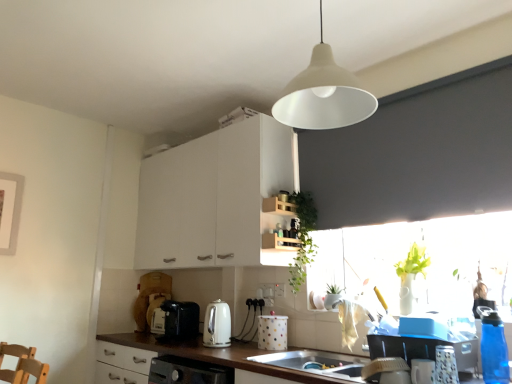
Question: Is there a large distance between black plastic toaster at lower center, the 7th appliance viewed from the front, and transparent glass window at right?

Choices:
 (A) no
 (B) yes

Answer: (B)

Question: Can you confirm if black plastic toaster at lower center, arranged as the first appliance when viewed from the back, is positioned to the right of transparent glass window at right?

Choices:
 (A) no
 (B) yes

Answer: (A)

Question: Does black plastic toaster at lower center, the seventh appliance positioned from the right, have a greater width compared to transparent glass window at right?

Choices:
 (A) yes
 (B) no

Answer: (A)

Question: Are black plastic toaster at lower center, the seventh appliance positioned from the right, and transparent glass window at right beside each other?

Choices:
 (A) no
 (B) yes

Answer: (A)

Question: Is black plastic toaster at lower center, the seventh appliance positioned from the right, oriented towards transparent glass window at right?

Choices:
 (A) no
 (B) yes

Answer: (A)

Question: Considering the relative sizes of black plastic toaster at lower center, arranged as the first appliance when viewed from the back, and transparent glass window at right in the image provided, is black plastic toaster at lower center, arranged as the first appliance when viewed from the back, smaller than transparent glass window at right?

Choices:
 (A) no
 (B) yes

Answer: (B)

Question: Can you confirm if blue translucent water bottle at right, which appears as the first appliance when viewed from the front, is positioned to the right of white plastic dish brush at lower right, positioned as the fourth appliance in back-to-front order?

Choices:
 (A) yes
 (B) no

Answer: (A)

Question: Considering the relative positions of blue translucent water bottle at right, the 1th appliance from the right, and white plastic dish brush at lower right, arranged as the third appliance when viewed from the left, in the image provided, is blue translucent water bottle at right, the 1th appliance from the right, to the left of white plastic dish brush at lower right, arranged as the third appliance when viewed from the left, from the viewer's perspective?

Choices:
 (A) yes
 (B) no

Answer: (B)

Question: Is blue translucent water bottle at right, the 1th appliance from the right, positioned behind white plastic dish brush at lower right, which ranks as the fourth appliance in front-to-back order?

Choices:
 (A) no
 (B) yes

Answer: (A)

Question: Can white plastic dish brush at lower right, positioned as the fourth appliance in back-to-front order, be found inside blue translucent water bottle at right, which appears as the first appliance when viewed from the front?

Choices:
 (A) yes
 (B) no

Answer: (B)

Question: From a real-world perspective, is blue translucent water bottle at right, the 1th appliance from the right, under white plastic dish brush at lower right, positioned as the fourth appliance in back-to-front order?

Choices:
 (A) yes
 (B) no

Answer: (B)

Question: Is the depth of blue translucent water bottle at right, which appears as the first appliance when viewed from the front, less than that of white plastic dish brush at lower right, positioned as the fourth appliance in back-to-front order?

Choices:
 (A) yes
 (B) no

Answer: (A)

Question: Is transparent glass window at right positioned far away from white matte cabinet at upper center?

Choices:
 (A) no
 (B) yes

Answer: (A)